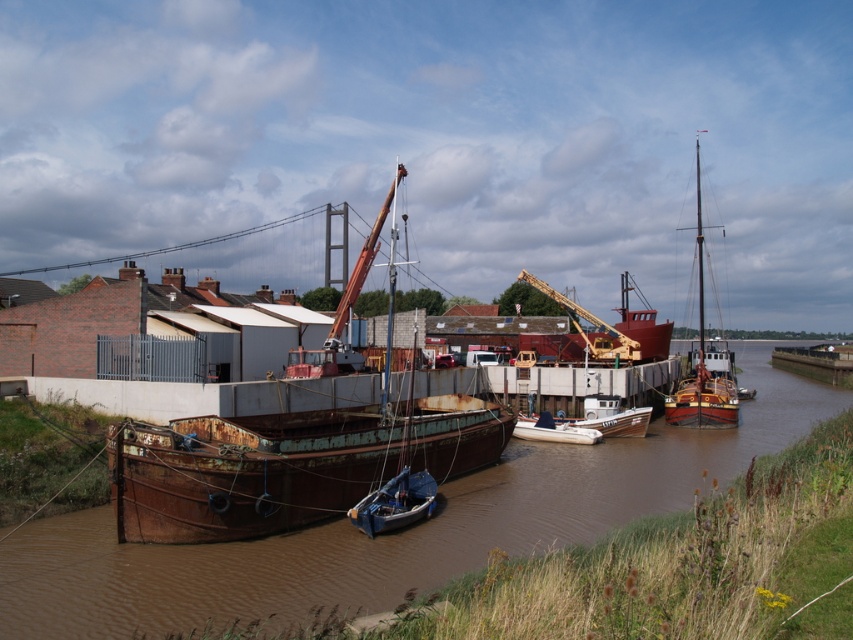
Can you confirm if rusty metal barge at center is positioned below white matte boat at center?

No.

Based on the photo, does rusty metal barge at center appear on the left side of white matte boat at center?

Yes, rusty metal barge at center is to the left of white matte boat at center.

Does point (387, 417) lie behind point (556, 428)?

No.

You are a GUI agent. You are given a task and a screenshot of the screen. Output one action in this format:
    pyautogui.click(x=<x>, y=<y>)
    Task: Click on the rusty metal barge at center
    
    Given the screenshot: What is the action you would take?
    pyautogui.click(x=286, y=464)

Looking at this image, does rustic wooden sailboat at right appear on the left side of metallic yellow crane at center?

No, rustic wooden sailboat at right is not to the left of metallic yellow crane at center.

Describe the element at coordinates (701, 362) in the screenshot. I see `rustic wooden sailboat at right` at that location.

Is point (666, 404) in front of point (637, 358)?

Yes, point (666, 404) is closer to viewer.

Where is `rustic wooden sailboat at right`? This screenshot has height=640, width=853. rustic wooden sailboat at right is located at coordinates (701, 362).

Is brown rusted water at center positioned before white plastic boat at center?

Yes, it is in front of white plastic boat at center.

Which is below, brown rusted water at center or white plastic boat at center?

brown rusted water at center is below.

Which is in front, point (125, 568) or point (624, 417)?

Point (125, 568)

Locate an element on the screen. brown rusted water at center is located at coordinates (392, 534).